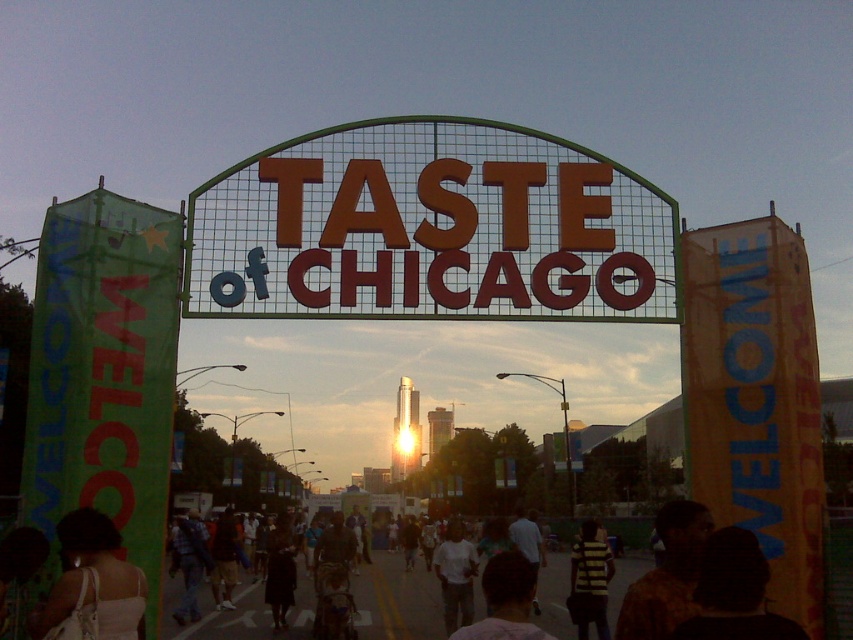
You are attending the Taste of Chicago event and notice a metallic gold sign at center and a white fabric bag at lower left. Which object is larger in size?

The metallic gold sign at center is bigger than the white fabric bag at lower left.